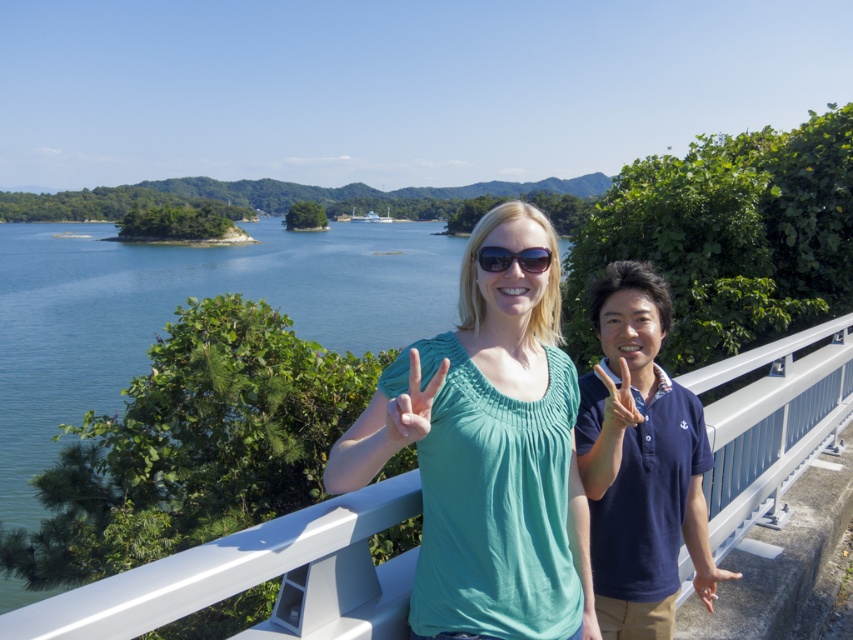
Question: Which point is closer to the camera?

Choices:
 (A) teal fabric shirt at center
 (B) navy blue polo shirt at center

Answer: (A)

Question: Which of the following is the farthest from the observer?

Choices:
 (A) (409, 358)
 (B) (529, 253)
 (C) (704, 563)

Answer: (C)

Question: Is green fabric hand at center wider than smooth skin hand at center?

Choices:
 (A) no
 (B) yes

Answer: (A)

Question: Can you confirm if teal fabric shirt at center is positioned above white matte hand at center?

Choices:
 (A) yes
 (B) no

Answer: (B)

Question: Which object is the closest to the smooth skin hand at center?

Choices:
 (A) navy blue polo shirt at center
 (B) sunglasses at center
 (C) teal fabric shirt at center
 (D) white matte hand at center

Answer: (A)

Question: Can you confirm if green fabric hand at center is wider than sunglasses at center?

Choices:
 (A) yes
 (B) no

Answer: (B)